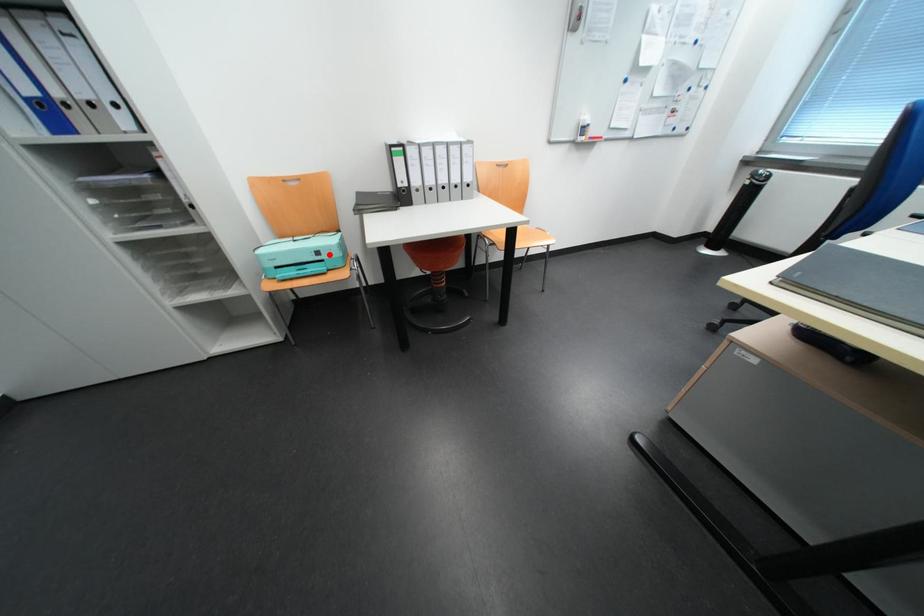
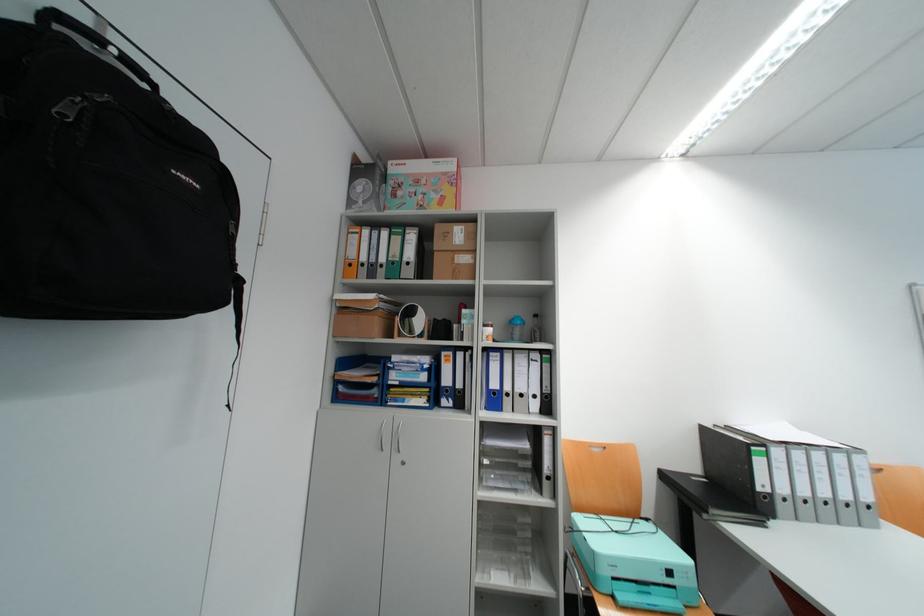
Where in the second image is the point corresponding to the highlighted location from the first image?

(682, 573)